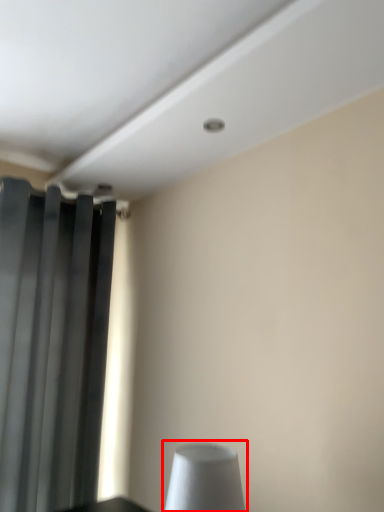
Question: From the image's perspective, considering the relative positions of table lamp (annotated by the red box) and curtain in the image provided, where is table lamp (annotated by the red box) located with respect to the staircase?

Choices:
 (A) above
 (B) below

Answer: (B)